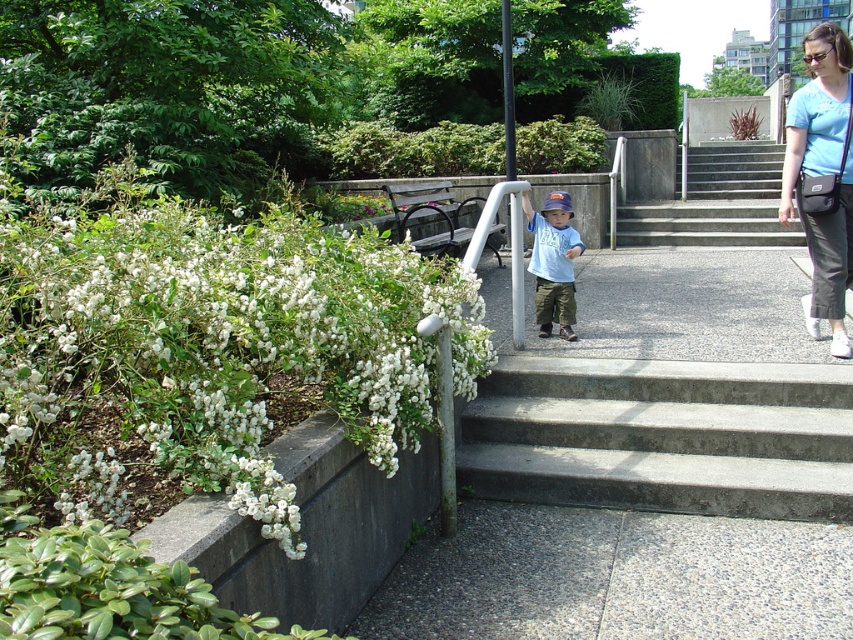
You are standing at the point labeled as point (636, 234) and want to walk to the point labeled as point (639, 467). Which direction should you move to get closer to your destination?

You should move towards the direction of point (639, 467) because it is closer to the viewer than point (636, 234). Since point (639, 467) is nearer, moving towards it would mean heading in the direction where the destination is located.